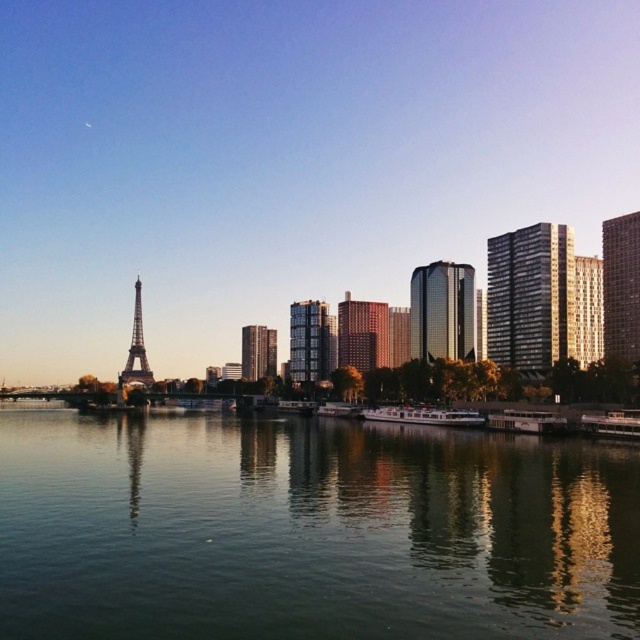
Describe the element at coordinates (308, 531) in the screenshot. I see `green reflective water at center` at that location.

Who is taller, green reflective water at center or shiny glass skyscraper at center right?

Standing taller between the two is shiny glass skyscraper at center right.

Is point (362, 513) positioned behind point (452, 307)?

That is False.

Find the location of a particular element. green reflective water at center is located at coordinates (308, 531).

In the scene shown: Between shiny glass skyscraper at center right and white glossy boat at lower center, which one is positioned higher?

Positioned higher is shiny glass skyscraper at center right.

Between shiny glass skyscraper at center right and white glossy boat at lower center, which one is positioned lower?

white glossy boat at lower center is below.

Between point (420, 291) and point (538, 424), which one is positioned in front?

Point (538, 424)

Locate an element on the screen. The image size is (640, 640). shiny glass skyscraper at center right is located at coordinates (442, 310).

Does green reflective water at center come in front of shiny glass building at center?

Yes, it is.

Can you confirm if green reflective water at center is positioned to the right of shiny glass building at center?

Correct, you'll find green reflective water at center to the right of shiny glass building at center.

Which is behind, point (264, 579) or point (262, 365)?

Positioned behind is point (262, 365).

You are a GUI agent. You are given a task and a screenshot of the screen. Output one action in this format:
    pyautogui.click(x=<x>, y=<y>)
    Task: Click on the green reflective water at center
    This screenshot has height=640, width=640.
    Given the screenshot: What is the action you would take?
    pyautogui.click(x=308, y=531)